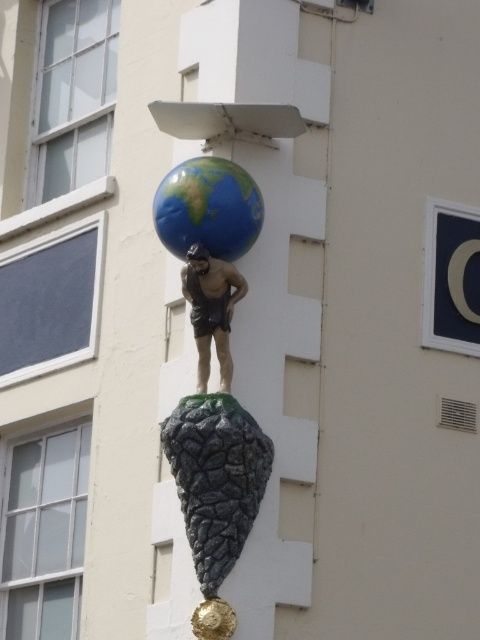
Question: Is polished stone globe at center further to camera compared to matte bronze statue at center?

Choices:
 (A) no
 (B) yes

Answer: (A)

Question: In this image, where is polished stone globe at center located relative to matte bronze statue at center?

Choices:
 (A) above
 (B) below

Answer: (B)

Question: Does polished stone globe at center appear on the left side of matte bronze statue at center?

Choices:
 (A) no
 (B) yes

Answer: (A)

Question: Among these objects, which one is nearest to the camera?

Choices:
 (A) polished stone globe at center
 (B) matte bronze statue at center

Answer: (A)